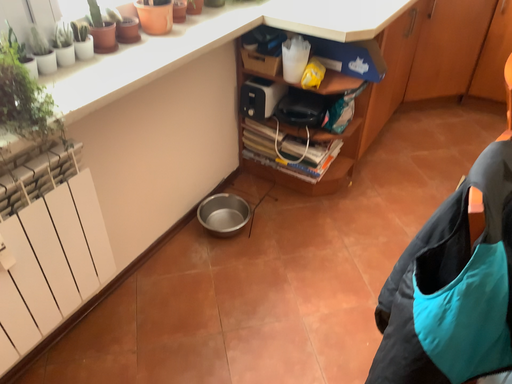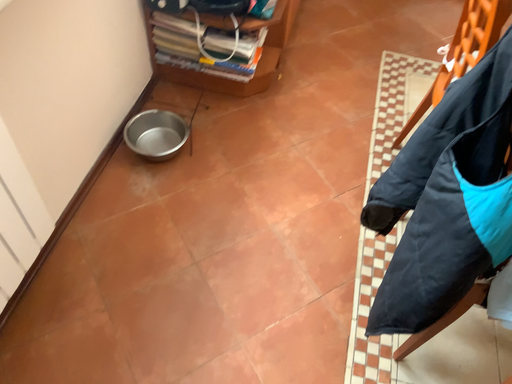
Question: How did the camera likely rotate when shooting the video?

Choices:
 (A) rotated downward
 (B) rotated upward

Answer: (A)